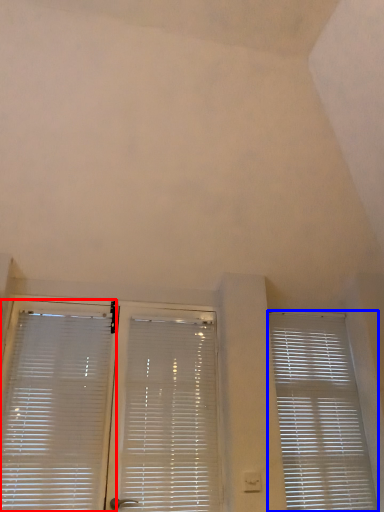
Question: Which of the following is the farthest to the observer, window blind (highlighted by a red box) or window blind (highlighted by a blue box)?

Choices:
 (A) window blind
 (B) window blind

Answer: (B)